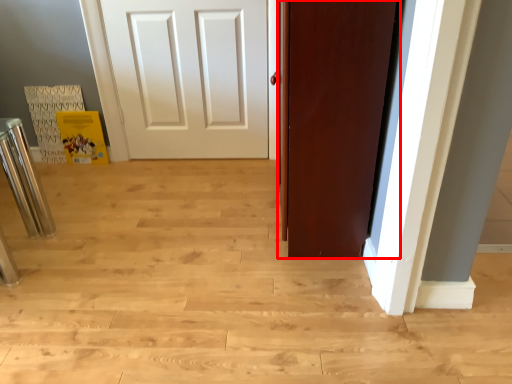
Question: In this image, where is door (annotated by the red box) located relative to bar stool?

Choices:
 (A) left
 (B) right

Answer: (B)